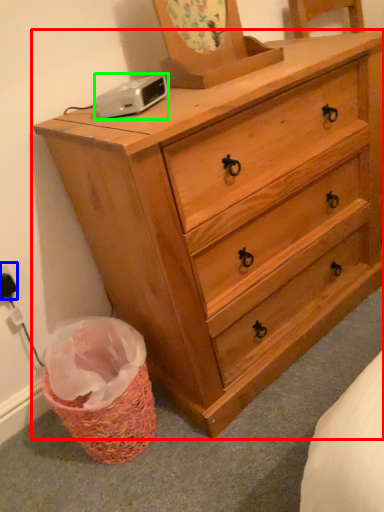
Question: Which object is the closest to the chest of drawers (highlighted by a red box)? Choose among these: electric outlet (highlighted by a blue box) or gadget (highlighted by a green box).

Choices:
 (A) electric outlet
 (B) gadget

Answer: (B)